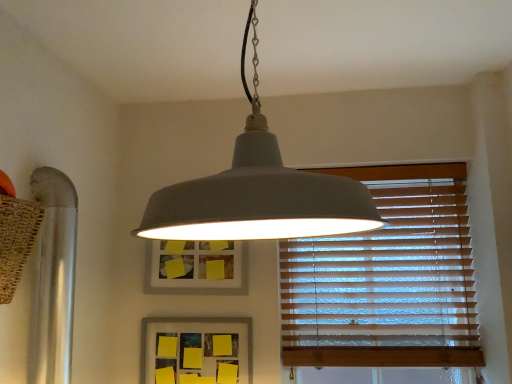
Question: Which direction should I rotate to face yellow matte picture frame at center, which appears as the 1th picture frame when ordered from the bottom, — up or down?

Choices:
 (A) up
 (B) down

Answer: (B)

Question: Considering the relative sizes of matte gray pendant light at center and yellow matte picture frame at center, which appears as the second picture frame when viewed from the top, in the image provided, is matte gray pendant light at center bigger than yellow matte picture frame at center, which appears as the second picture frame when viewed from the top,?

Choices:
 (A) no
 (B) yes

Answer: (B)

Question: Is matte gray pendant light at center at the right side of yellow matte picture frame at center, which appears as the second picture frame when viewed from the top?

Choices:
 (A) no
 (B) yes

Answer: (B)

Question: Is matte gray pendant light at center touching yellow matte picture frame at center, which appears as the 1th picture frame when ordered from the bottom?

Choices:
 (A) yes
 (B) no

Answer: (B)

Question: Considering the relative positions of matte gray pendant light at center and yellow matte picture frame at center, which appears as the second picture frame when viewed from the top, in the image provided, is matte gray pendant light at center behind yellow matte picture frame at center, which appears as the second picture frame when viewed from the top,?

Choices:
 (A) yes
 (B) no

Answer: (B)

Question: From the image's perspective, is matte gray pendant light at center above yellow matte picture frame at center, which appears as the second picture frame when viewed from the top?

Choices:
 (A) yes
 (B) no

Answer: (A)

Question: Considering the relative sizes of matte gray pendant light at center and yellow matte picture frame at center, which appears as the second picture frame when viewed from the top, in the image provided, is matte gray pendant light at center smaller than yellow matte picture frame at center, which appears as the second picture frame when viewed from the top,?

Choices:
 (A) no
 (B) yes

Answer: (A)

Question: Can you confirm if wooden blinds at right is thinner than matte gray picture frame at center, acting as the first picture frame starting from the top?

Choices:
 (A) yes
 (B) no

Answer: (B)

Question: Is wooden blinds at right shorter than matte gray picture frame at center, the second picture frame ordered from the bottom?

Choices:
 (A) no
 (B) yes

Answer: (A)

Question: Is wooden blinds at right completely or partially outside of matte gray picture frame at center, acting as the first picture frame starting from the top?

Choices:
 (A) yes
 (B) no

Answer: (A)

Question: Would you say wooden blinds at right is a long distance from matte gray picture frame at center, the second picture frame ordered from the bottom?

Choices:
 (A) no
 (B) yes

Answer: (A)

Question: Does wooden blinds at right have a smaller size compared to matte gray picture frame at center, the second picture frame ordered from the bottom?

Choices:
 (A) yes
 (B) no

Answer: (B)

Question: From a real-world perspective, is wooden blinds at right on matte gray picture frame at center, the second picture frame ordered from the bottom?

Choices:
 (A) yes
 (B) no

Answer: (B)

Question: Would you consider matte gray picture frame at center, acting as the first picture frame starting from the top, to be distant from yellow matte picture frame at center, which appears as the second picture frame when viewed from the top?

Choices:
 (A) yes
 (B) no

Answer: (B)